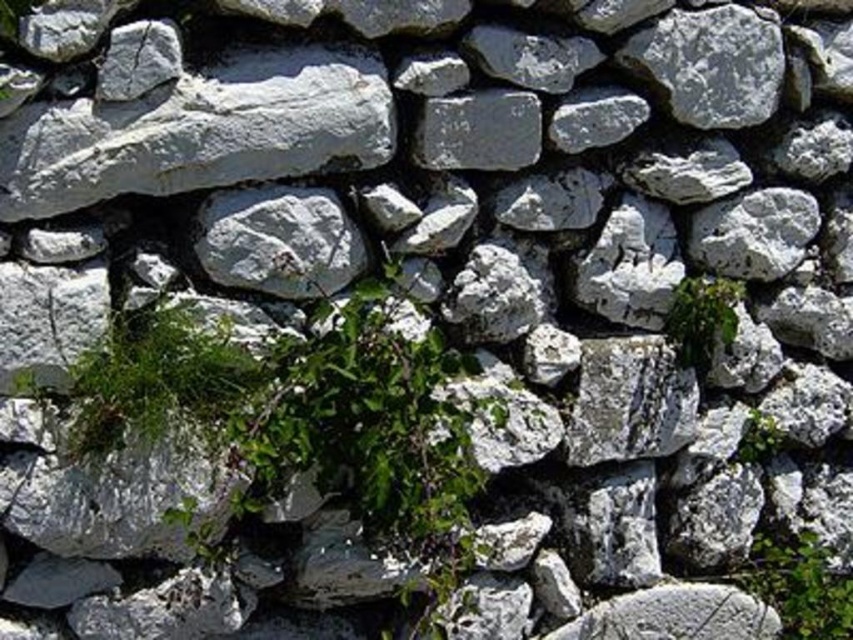
Between point (846, 602) and point (764, 456), which one is positioned behind?

Positioned behind is point (764, 456).

Can you confirm if green leafy plant at lower right is positioned below green leafy plant at center-right?

Yes, green leafy plant at lower right is below green leafy plant at center-right.

Is point (793, 636) positioned behind point (770, 428)?

No, it is in front of (770, 428).

You are a GUI agent. You are given a task and a screenshot of the screen. Output one action in this format:
    pyautogui.click(x=<x>, y=<y>)
    Task: Click on the green leafy plant at lower right
    
    Given the screenshot: What is the action you would take?
    pyautogui.click(x=798, y=582)

Can you confirm if green leafy plant at lower right is positioned above green leafy plant at center?

Incorrect, green leafy plant at lower right is not positioned above green leafy plant at center.

Is green leafy plant at lower right positioned before green leafy plant at center?

No, it is not.

Consider the image. Who is more forward, (782, 604) or (688, 284)?

Point (688, 284) is in front.

You are a GUI agent. You are given a task and a screenshot of the screen. Output one action in this format:
    pyautogui.click(x=<x>, y=<y>)
    Task: Click on the green leafy plant at lower right
    
    Given the screenshot: What is the action you would take?
    pyautogui.click(x=798, y=582)

Can you confirm if green leafy plant at center is taller than green leafy plant at center-right?

Correct, green leafy plant at center is much taller as green leafy plant at center-right.

Which is behind, point (686, 321) or point (758, 435)?

The point (758, 435) is behind.

You are a GUI agent. You are given a task and a screenshot of the screen. Output one action in this format:
    pyautogui.click(x=<x>, y=<y>)
    Task: Click on the green leafy plant at center
    Image resolution: width=853 pixels, height=640 pixels.
    Given the screenshot: What is the action you would take?
    pyautogui.click(x=701, y=317)